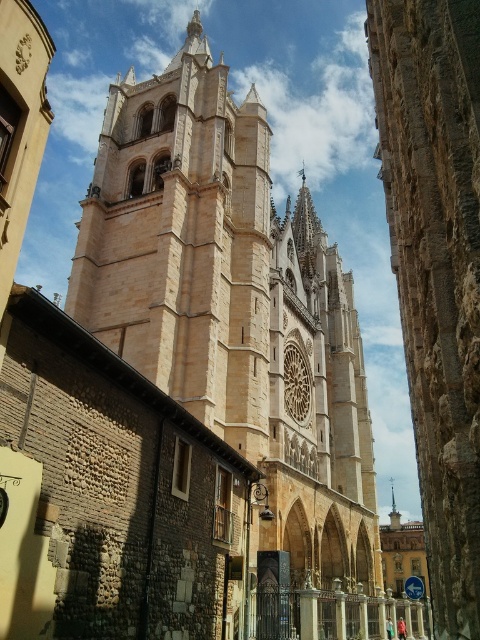
You are standing in front of the cathedral and want to locate the beige stone tower at center. According to the coordinates provided, where should you look relative to the center of the image?

The beige stone tower at center is located at point coordinates approximately 0.477 on the x axis and 0.485 on the y axis, which is very close to the center of the image.

You are an architect analyzing the cathedral design. You see the beige stone tower at center and the smooth silver spire at center. Which one is located to the left when viewed from the front?

The beige stone tower at center is positioned on the left side of smooth silver spire at center, so it is located to the left when viewed from the front.

You are standing in front of the cathedral and want to take a photo of the beige stone tower at center and the smooth silver spire at center. Which one appears higher in the image?

The beige stone tower at center is positioned over the smooth silver spire at center, so it appears higher in the image.